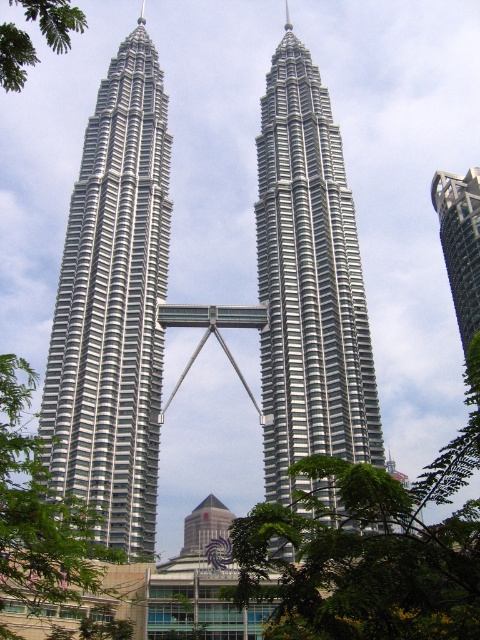
Question: Does silver metallic building at center come behind green leafy tree at center?

Choices:
 (A) no
 (B) yes

Answer: (B)

Question: Is green leafy tree at left closer to the viewer compared to green leafy tree at upper left?

Choices:
 (A) no
 (B) yes

Answer: (A)

Question: Which point is closer to the camera taking this photo?

Choices:
 (A) (135, 298)
 (B) (382, 608)
 (C) (70, 572)

Answer: (B)

Question: Which of the following is the farthest from the observer?

Choices:
 (A) (63, 598)
 (B) (444, 221)

Answer: (B)

Question: Which object appears closest to the camera in this image?

Choices:
 (A) silver metallic skyscraper at upper right
 (B) green leafy tree at center
 (C) green leafy tree at upper left

Answer: (B)

Question: Can you confirm if polished steel skyscraper at center is wider than silver metallic skyscraper at upper right?

Choices:
 (A) no
 (B) yes

Answer: (B)